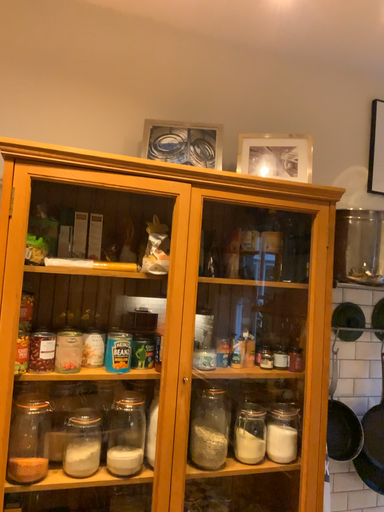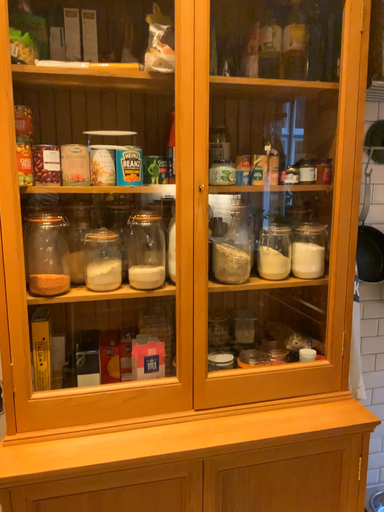
Question: How did the camera likely rotate when shooting the video?

Choices:
 (A) rotated downward
 (B) rotated upward

Answer: (A)